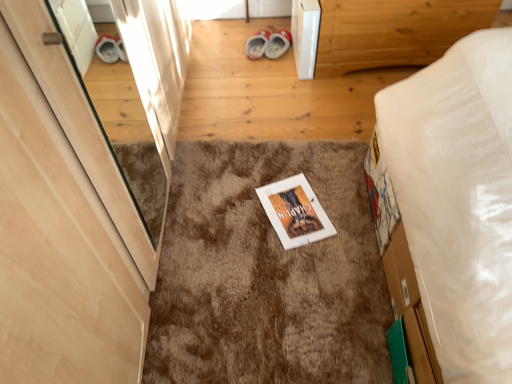
Image resolution: width=512 pixels, height=384 pixels. Find the location of `free space between red suede shoes at center and brown shaggy carpet at center`. free space between red suede shoes at center and brown shaggy carpet at center is located at coordinates (260, 100).